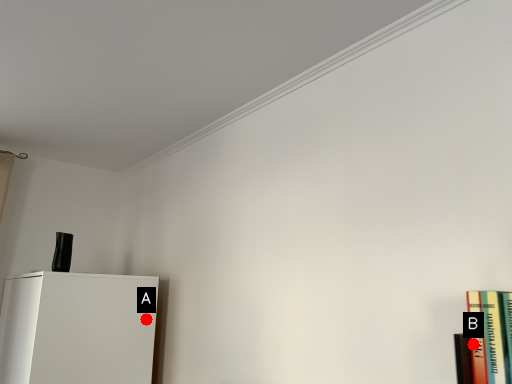
Question: Two points are circled on the image, labeled by A and B beside each circle. Which point is closer to the camera?

Choices:
 (A) A is closer
 (B) B is closer

Answer: (B)